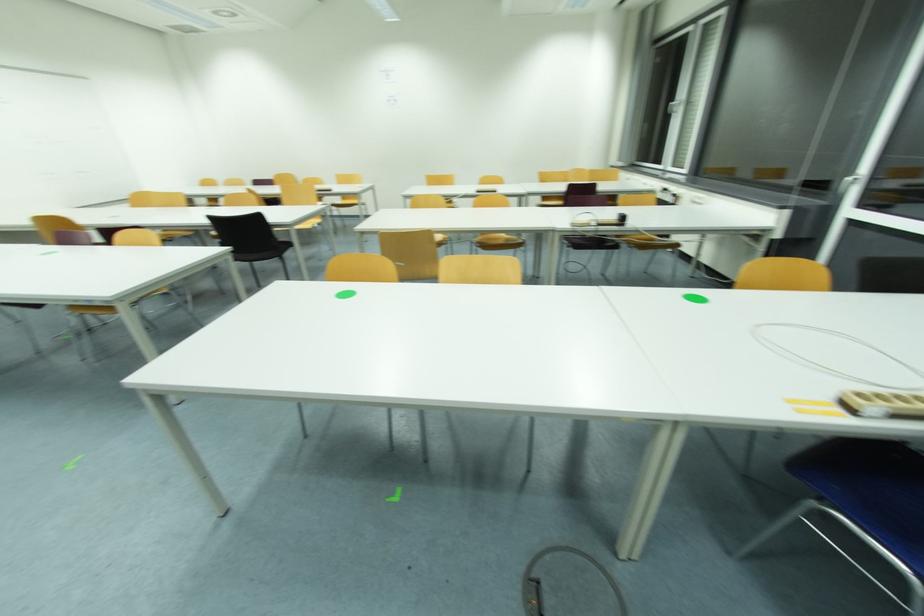
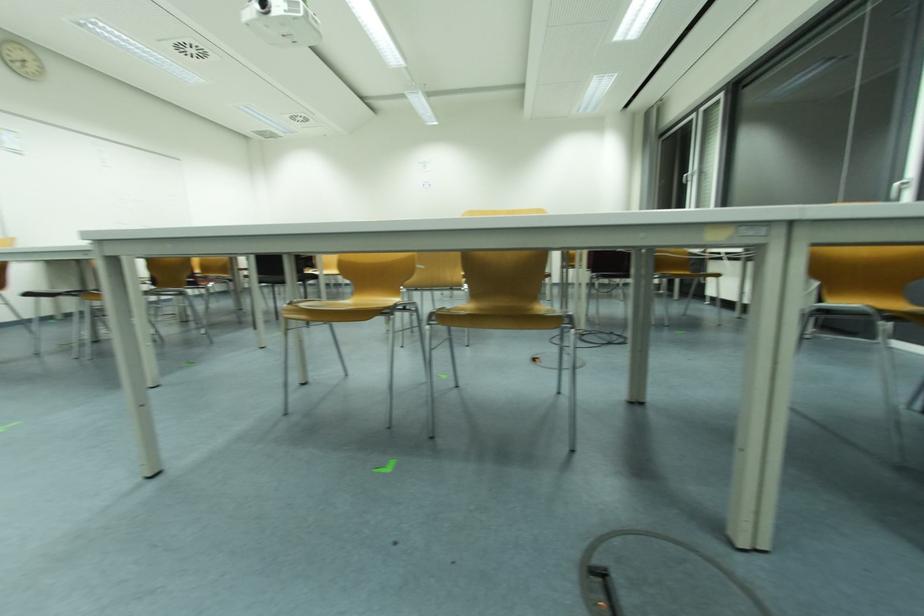
Question: How did the camera likely rotate?

Choices:
 (A) Left
 (B) Right
 (C) Up
 (D) Down

Answer: (C)